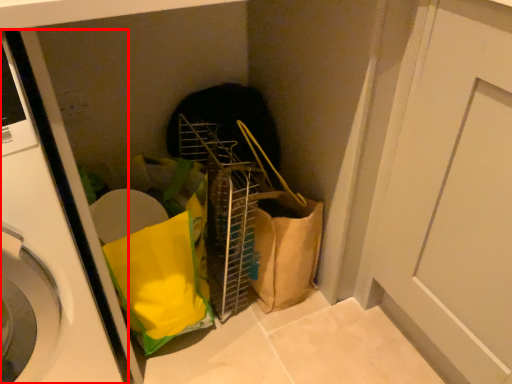
Question: From the image's perspective, considering the relative positions of washing machine (annotated by the red box) and door in the image provided, where is washing machine (annotated by the red box) located with respect to the staircase?

Choices:
 (A) below
 (B) above

Answer: (B)